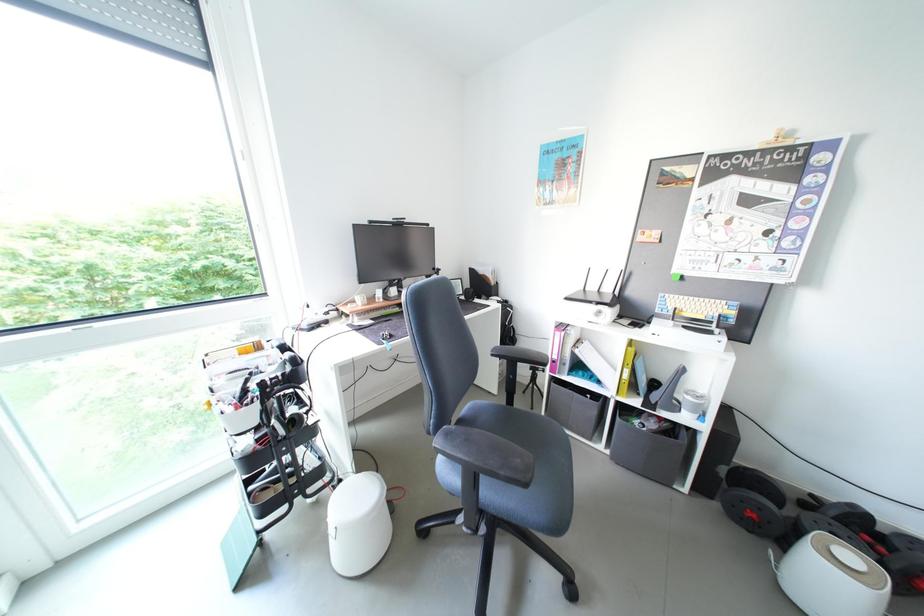
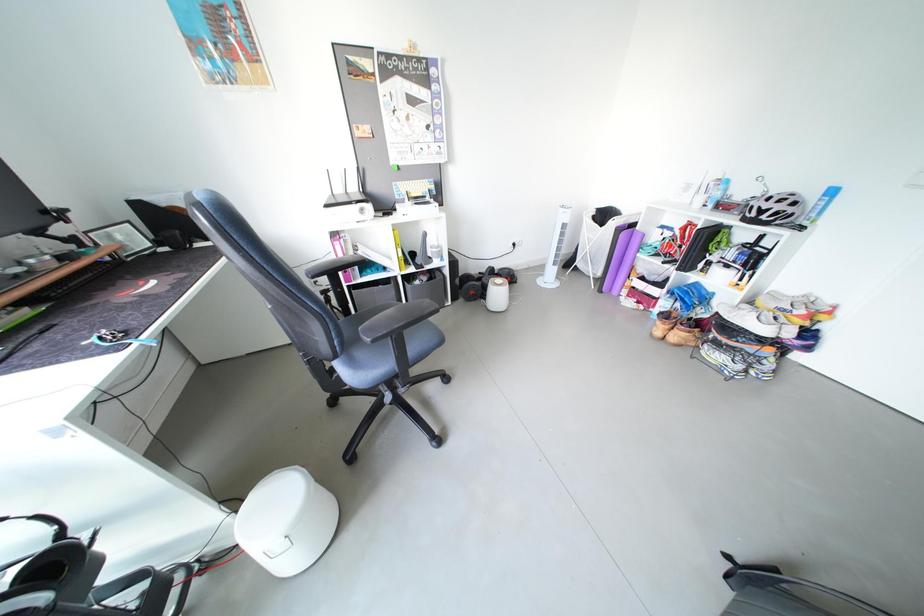
The first image is from the beginning of the video and the second image is from the end. How did the camera likely rotate when shooting the video?

The camera's rotation is toward right-down.